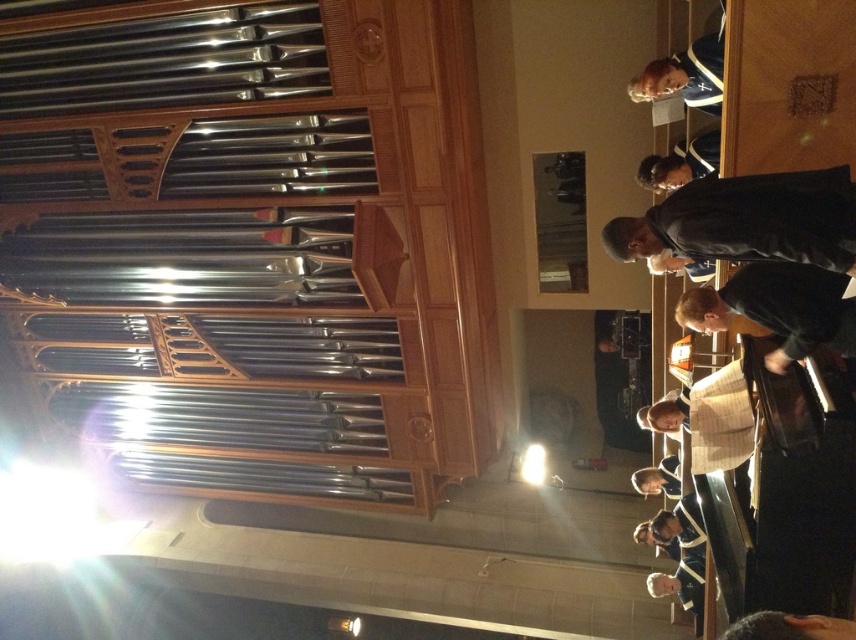
Question: Is black matte jacket at upper right thinner than black leather jacket at upper right?

Choices:
 (A) yes
 (B) no

Answer: (B)

Question: Is black matte jacket at upper right closer to the viewer compared to blue fabric at upper center?

Choices:
 (A) no
 (B) yes

Answer: (B)

Question: Among these points, which one is farthest from the camera?

Choices:
 (A) (664, 56)
 (B) (794, 358)

Answer: (A)

Question: Which of the following is the farthest from the observer?

Choices:
 (A) (613, 230)
 (B) (670, 172)

Answer: (B)

Question: Can you confirm if black matte conductor at lower right is positioned above blue fabric at upper center?

Choices:
 (A) yes
 (B) no

Answer: (B)

Question: Among these objects, which one is nearest to the camera?

Choices:
 (A) black leather jacket at upper right
 (B) black matte conductor at lower right
 (C) blue fabric at upper center
 (D) black matte jacket at upper right

Answer: (D)